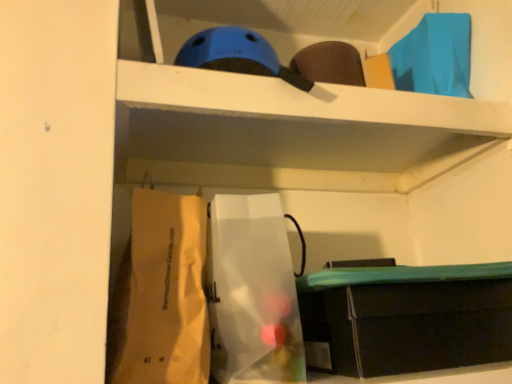
Question: Considering the relative sizes of matte black storage box at lower right and translucent plastic bag at center, the first paper bag when ordered from right to left, in the image provided, is matte black storage box at lower right taller than translucent plastic bag at center, the first paper bag when ordered from right to left,?

Choices:
 (A) yes
 (B) no

Answer: (B)

Question: From the image's perspective, is matte black storage box at lower right over translucent plastic bag at center, the first paper bag when ordered from right to left?

Choices:
 (A) yes
 (B) no

Answer: (B)

Question: From a real-world perspective, is matte black storage box at lower right located beneath translucent plastic bag at center, the second paper bag viewed from the left?

Choices:
 (A) no
 (B) yes

Answer: (B)

Question: Does matte black storage box at lower right lie behind translucent plastic bag at center, the second paper bag viewed from the left?

Choices:
 (A) yes
 (B) no

Answer: (A)

Question: Is matte black storage box at lower right outside translucent plastic bag at center, the first paper bag when ordered from right to left?

Choices:
 (A) yes
 (B) no

Answer: (A)

Question: In terms of height, does white paper bag at lower left, marked as the 1th paper bag in a left-to-right arrangement, look taller or shorter compared to translucent plastic bag at center, the second paper bag viewed from the left?

Choices:
 (A) tall
 (B) short

Answer: (B)

Question: Does point (178, 339) appear closer or farther from the camera than point (280, 274)?

Choices:
 (A) farther
 (B) closer

Answer: (B)

Question: Based on their sizes in the image, would you say white paper bag at lower left, arranged as the 2th paper bag when viewed from the right, is bigger or smaller than translucent plastic bag at center, the first paper bag when ordered from right to left?

Choices:
 (A) big
 (B) small

Answer: (B)

Question: From the image's perspective, is white paper bag at lower left, arranged as the 2th paper bag when viewed from the right, above or below translucent plastic bag at center, the second paper bag viewed from the left?

Choices:
 (A) above
 (B) below

Answer: (A)

Question: Does point (150, 211) appear closer or farther from the camera than point (391, 339)?

Choices:
 (A) farther
 (B) closer

Answer: (A)

Question: Is white paper bag at lower left, arranged as the 2th paper bag when viewed from the right, in front of or behind matte black storage box at lower right in the image?

Choices:
 (A) behind
 (B) front

Answer: (B)

Question: Considering the positions of white paper bag at lower left, marked as the 1th paper bag in a left-to-right arrangement, and matte black storage box at lower right in the image, is white paper bag at lower left, marked as the 1th paper bag in a left-to-right arrangement, wider or thinner than matte black storage box at lower right?

Choices:
 (A) thin
 (B) wide

Answer: (A)

Question: Considering the positions of white paper bag at lower left, marked as the 1th paper bag in a left-to-right arrangement, and matte black storage box at lower right in the image, is white paper bag at lower left, marked as the 1th paper bag in a left-to-right arrangement, bigger or smaller than matte black storage box at lower right?

Choices:
 (A) small
 (B) big

Answer: (A)

Question: Considering the positions of point (278, 349) and point (151, 201), is point (278, 349) closer or farther from the camera than point (151, 201)?

Choices:
 (A) closer
 (B) farther

Answer: (A)

Question: Considering their positions, is translucent plastic bag at center, the first paper bag when ordered from right to left, located in front of or behind white paper bag at lower left, arranged as the 2th paper bag when viewed from the right?

Choices:
 (A) front
 (B) behind

Answer: (B)